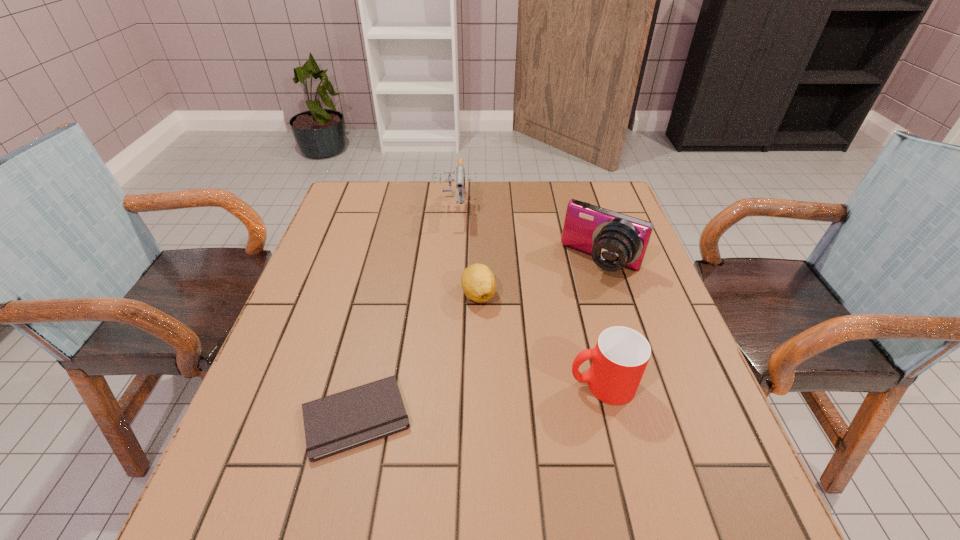
In order to click on blank space located at the stem end of the lemon in this screenshot , I will do `click(449, 455)`.

This screenshot has width=960, height=540. In order to click on free space located 0.200m at the stem end of the lemon in this screenshot , I will do `click(463, 383)`.

In order to click on vacant region located 0.290m at the barrel end of the gun in this screenshot , I will do `click(453, 296)`.

Locate an element on the screen. blank space located 0.260m at the barrel end of the gun is located at coordinates (453, 288).

Identify the location of vacant space located at the barrel end of the gun. (452, 299).

This screenshot has height=540, width=960. In order to click on vacant space situated on the front-facing side of the camera in this screenshot , I will do `click(532, 366)`.

The image size is (960, 540). Identify the location of vacant space located 0.340m on the front-facing side of the camera. (523, 380).

This screenshot has width=960, height=540. I want to click on free space located on the front-facing side of the camera, so click(x=571, y=307).

Locate an element on the screen. The height and width of the screenshot is (540, 960). object at the far edge is located at coordinates (460, 177).

I want to click on object located at the near edge, so click(336, 423).